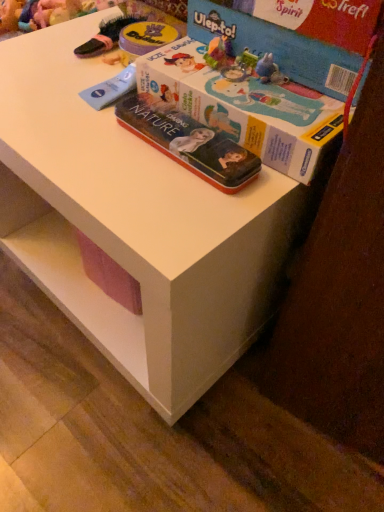
At what (x,y) coordinates should I click in order to perform the action: click on free space in front of metallic tin box at center. Please return your answer as a coordinate pair (x, y). Looking at the image, I should click on (167, 210).